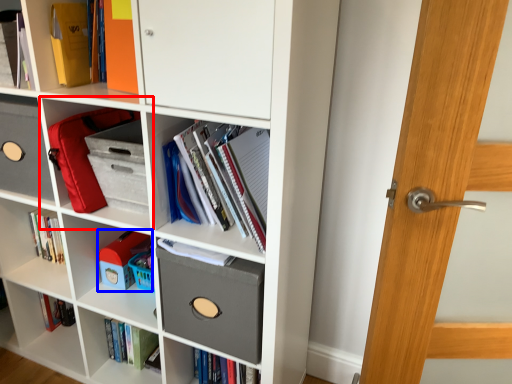
Question: Which object is closer to the camera taking this photo, shelf (highlighted by a red box) or toy (highlighted by a blue box)?

Choices:
 (A) shelf
 (B) toy

Answer: (A)